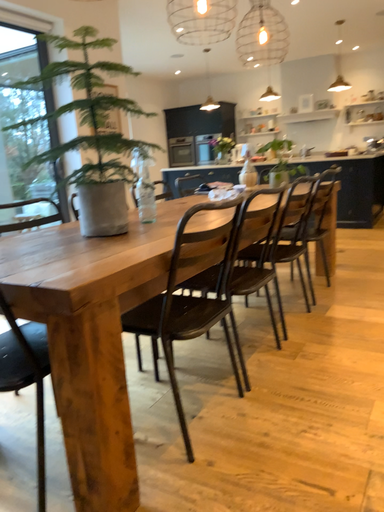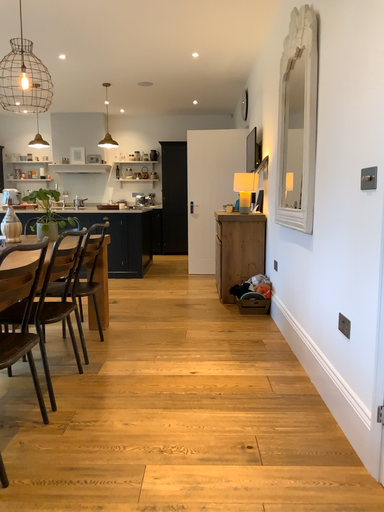
Question: Which way did the camera rotate in the video?

Choices:
 (A) rotated downward
 (B) rotated upward

Answer: (B)